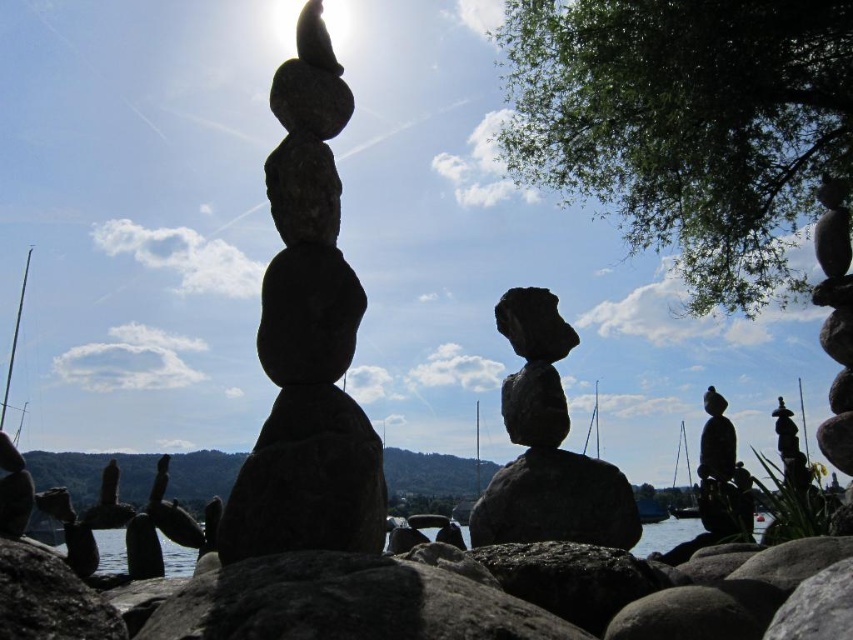
Question: Which of the following is the farthest from the observer?

Choices:
 (A) (321, 212)
 (B) (660, 545)
 (C) (547, 296)
 (D) (737, 480)

Answer: (B)

Question: Can you confirm if smooth gray rock stack at center is smaller than transparent water at center?

Choices:
 (A) no
 (B) yes

Answer: (B)

Question: Does black stone statue at right have a lesser width compared to transparent water at center?

Choices:
 (A) no
 (B) yes

Answer: (B)

Question: Which object is positioned closest to the rough stone stack at center?

Choices:
 (A) black stone statue at right
 (B) transparent water at center

Answer: (B)

Question: Among these points, which one is farthest from the camera?

Choices:
 (A) (165, 538)
 (B) (706, 509)
 (C) (581, 465)
 (D) (271, 310)

Answer: (A)

Question: Is smooth gray rock stack at center bigger than transparent water at center?

Choices:
 (A) no
 (B) yes

Answer: (A)